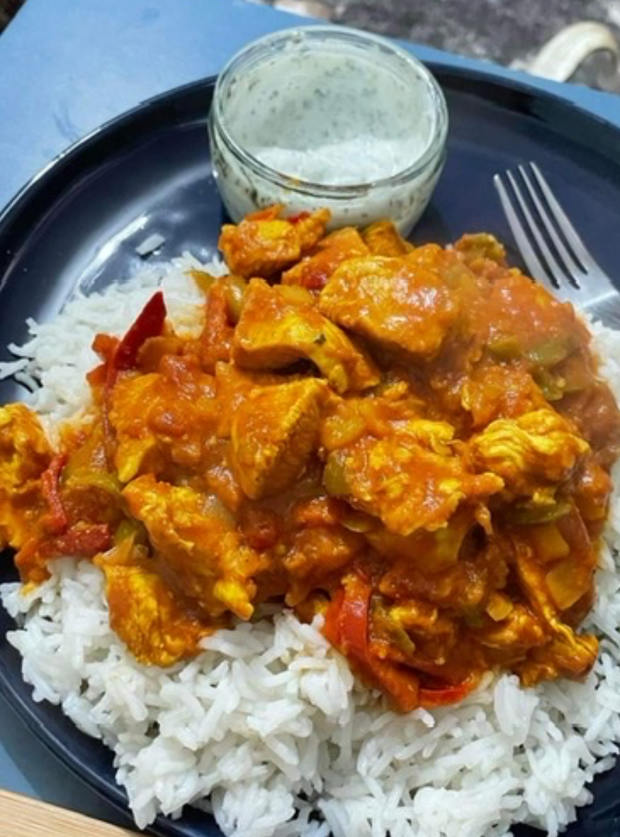
The width and height of the screenshot is (620, 837). I want to click on prongs on fork, so click(496, 177), click(511, 173), click(521, 171), click(534, 162).